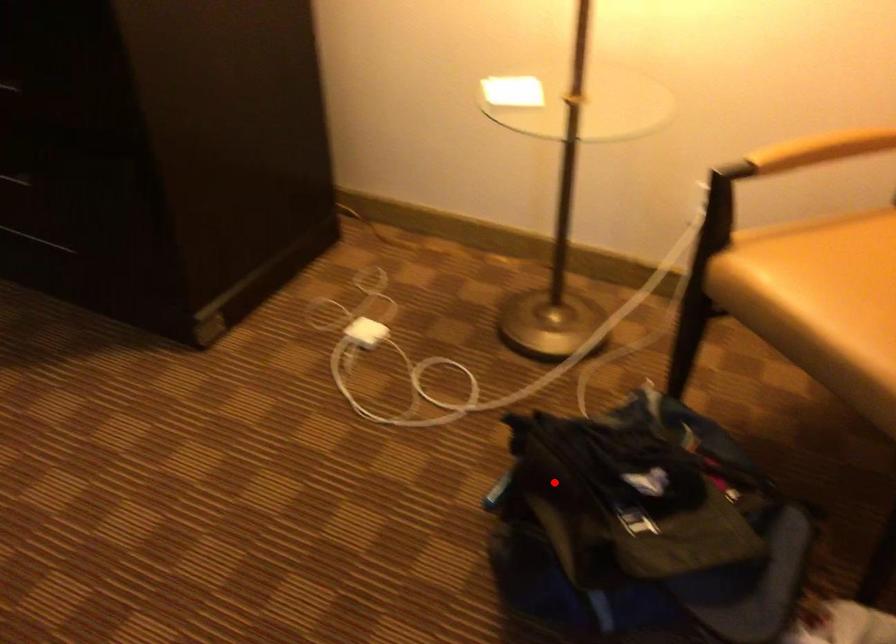
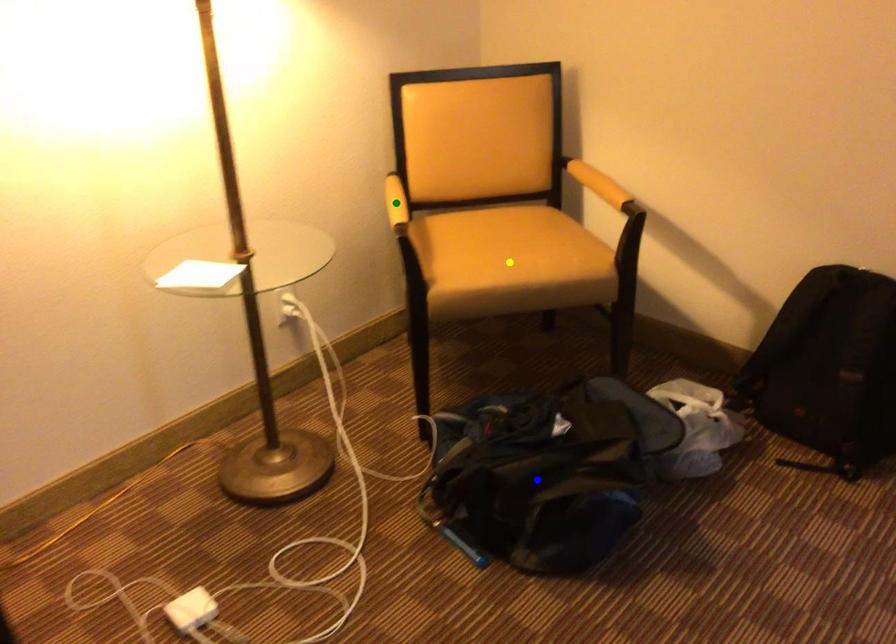
Question: I am providing you with two images of the same scene from different viewpoints. A red point is marked on the first image. You are given multiple points on the second image. Which spot in image 2 lines up with the point in image 1?

Choices:
 (A) green point
 (B) yellow point
 (C) blue point

Answer: (C)